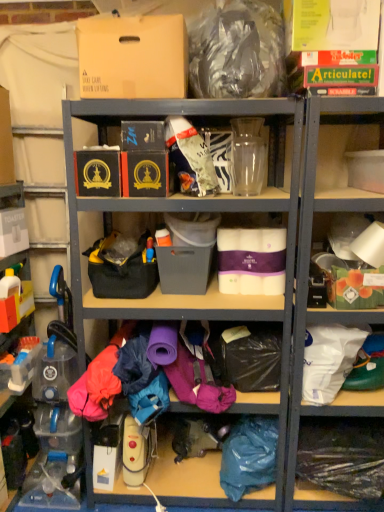
Question: Is matte black box at upper center, which is the second storage box from left to right, not inside white paper towel at right, arranged as the fourth shelf when viewed from the left?

Choices:
 (A) no
 (B) yes

Answer: (B)

Question: Is matte black box at upper center, placed as the 6th storage box when sorted from right to left, at the right side of white paper towel at right, arranged as the fourth shelf when viewed from the left?

Choices:
 (A) no
 (B) yes

Answer: (A)

Question: Is matte black box at upper center, placed as the 6th storage box when sorted from right to left, smaller than white paper towel at right, the second shelf when ordered from right to left?

Choices:
 (A) yes
 (B) no

Answer: (A)

Question: Does matte black box at upper center, placed as the 6th storage box when sorted from right to left, turn towards white paper towel at right, arranged as the fourth shelf when viewed from the left?

Choices:
 (A) no
 (B) yes

Answer: (A)

Question: From the image's perspective, is matte black box at upper center, which is the second storage box from left to right, over white paper towel at right, the second shelf when ordered from right to left?

Choices:
 (A) yes
 (B) no

Answer: (A)

Question: Is matte black box at upper center, which is the second storage box from left to right, directly adjacent to white paper towel at right, arranged as the fourth shelf when viewed from the left?

Choices:
 (A) yes
 (B) no

Answer: (B)

Question: Considering the relative sizes of white plastic toaster at left, arranged as the 1th storage box when viewed from the left, and white paper towel at right, the second shelf when ordered from right to left, in the image provided, is white plastic toaster at left, arranged as the 1th storage box when viewed from the left, bigger than white paper towel at right, the second shelf when ordered from right to left,?

Choices:
 (A) yes
 (B) no

Answer: (B)

Question: Considering the relative sizes of white plastic toaster at left, the seventh storage box from the right, and white paper towel at right, arranged as the fourth shelf when viewed from the left, in the image provided, is white plastic toaster at left, the seventh storage box from the right, shorter than white paper towel at right, arranged as the fourth shelf when viewed from the left,?

Choices:
 (A) no
 (B) yes

Answer: (B)

Question: Can you confirm if white plastic toaster at left, the seventh storage box from the right, is positioned to the right of white paper towel at right, arranged as the fourth shelf when viewed from the left?

Choices:
 (A) no
 (B) yes

Answer: (A)

Question: Is white plastic toaster at left, arranged as the 1th storage box when viewed from the left, taller than white paper towel at right, the second shelf when ordered from right to left?

Choices:
 (A) yes
 (B) no

Answer: (B)

Question: Can you confirm if white plastic toaster at left, the seventh storage box from the right, is thinner than white paper towel at right, the second shelf when ordered from right to left?

Choices:
 (A) yes
 (B) no

Answer: (A)

Question: Is the position of white plastic toaster at left, arranged as the 1th storage box when viewed from the left, less distant than that of white paper towel at right, arranged as the fourth shelf when viewed from the left?

Choices:
 (A) no
 (B) yes

Answer: (A)

Question: From the image's perspective, would you say white matte tissue box at center, the sixth storage box in the left-to-right sequence, is positioned over clear plastic bottle at lower left, the 2th shelf from the left?

Choices:
 (A) yes
 (B) no

Answer: (A)